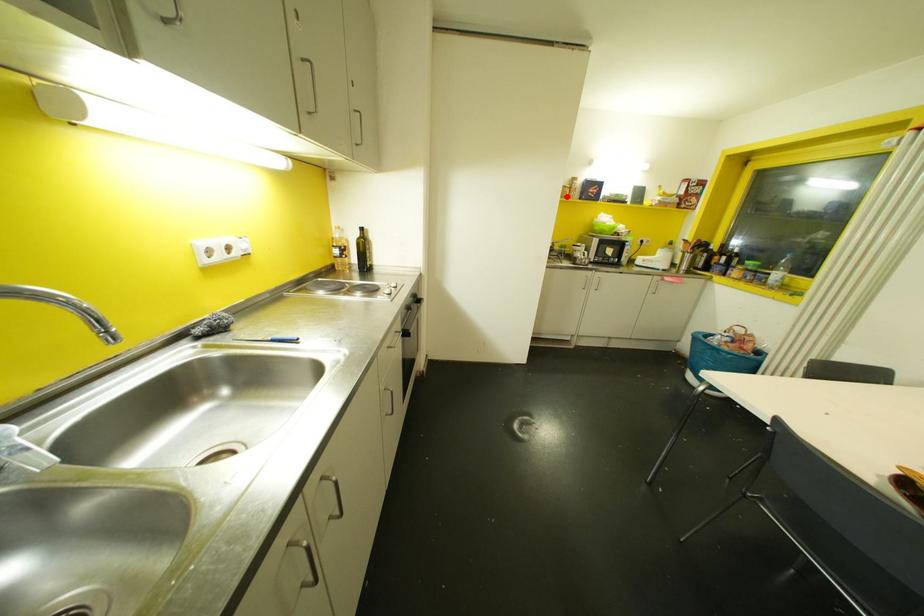
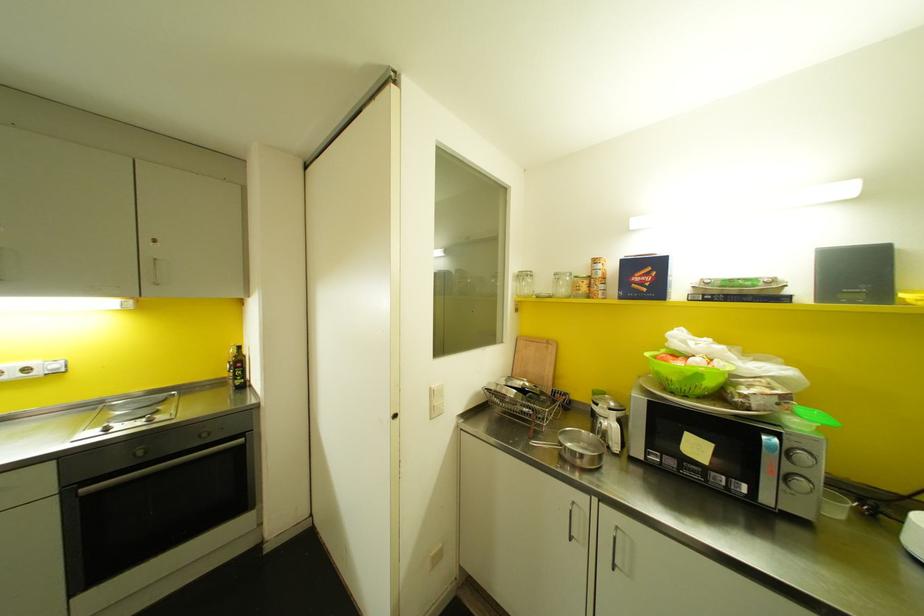
The point at the highlighted location is marked in the first image. Where is the corresponding point in the second image?

(588, 294)